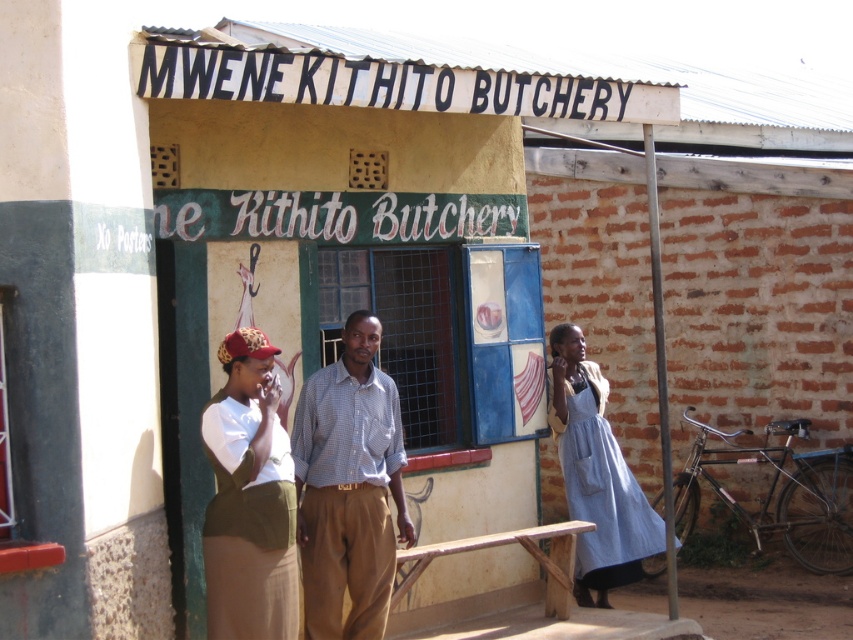
This screenshot has width=853, height=640. Describe the element at coordinates (248, 499) in the screenshot. I see `matte khaki vest at left` at that location.

Consider the image. Is matte khaki vest at left wider than denim dress at right?

No, matte khaki vest at left is not wider than denim dress at right.

Where is `matte khaki vest at left`? This screenshot has width=853, height=640. matte khaki vest at left is located at coordinates (248, 499).

Is checkered fabric shirt at center smaller than matte khaki vest at left?

No.

Between point (323, 570) and point (276, 512), which one is positioned behind?

The point (323, 570) is more distant.

This screenshot has width=853, height=640. In order to click on checkered fabric shirt at center in this screenshot , I will do `click(347, 488)`.

At what (x,y) coordinates should I click in order to perform the action: click on checkered fabric shirt at center. Please return your answer as a coordinate pair (x, y). Image resolution: width=853 pixels, height=640 pixels. Looking at the image, I should click on (347, 488).

You are a GUI agent. You are given a task and a screenshot of the screen. Output one action in this format:
    pyautogui.click(x=<x>, y=<y>)
    Task: Click on the checkered fabric shirt at center
    The image size is (853, 640).
    Given the screenshot: What is the action you would take?
    pyautogui.click(x=347, y=488)

From the picture: Is checkered fabric shirt at center bigger than denim dress at right?

No.

Does point (363, 576) come farther from viewer compared to point (582, 381)?

No, it is not.

Image resolution: width=853 pixels, height=640 pixels. I want to click on checkered fabric shirt at center, so click(x=347, y=488).